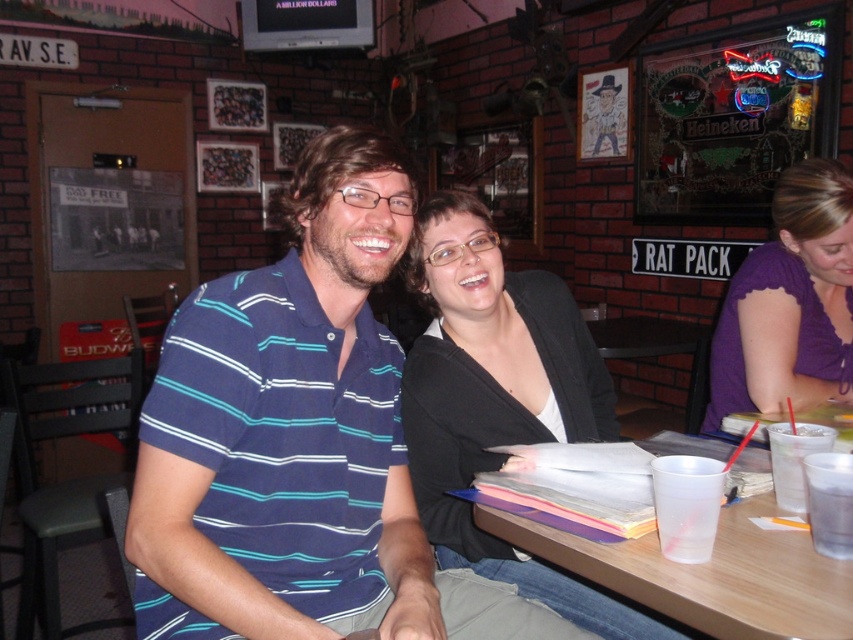
You are a photographer standing at the center of the room. You want to take a photo of the purple satin blouse at upper right. Which direction should you move to get it centered in your viewfinder?

Since the purple satin blouse at upper right is located at coordinates approximately 0.475 along the horizontal axis and 0.926 along the vertical axis, you should move slightly to your left and downward to center it in the viewfinder.

You are standing in the bar and want to hand a drink to the person wearing the black matte cardigan at center. Based on their position, which direction should you approach from?

The black matte cardigan at center is located at point (498, 400), so you should approach from the right side to hand them the drink.

You are a bartender preparing to place a clear plastic cup at lower right on top of the purple satin blouse at upper right. Considering their sizes, do you think the cup will fit without slipping off?

The purple satin blouse at upper right is thinner than the clear plastic cup at lower right. Since the blouse is thinner, placing the wider cup on it might cause it to slip off or not fit properly.